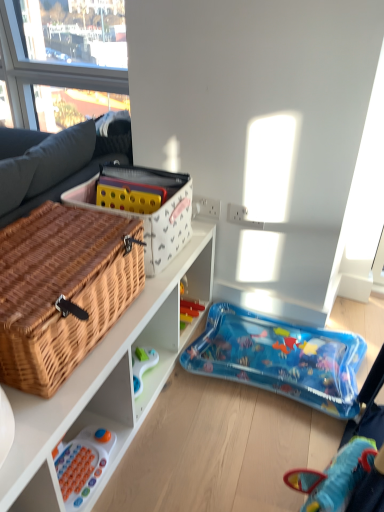
Identify the location of free space between blue inflatable pool at lower right, the first toy when ordered from top to bottom, and white plastic toy at lower left, which is the 1th toy from front to back. (205, 434).